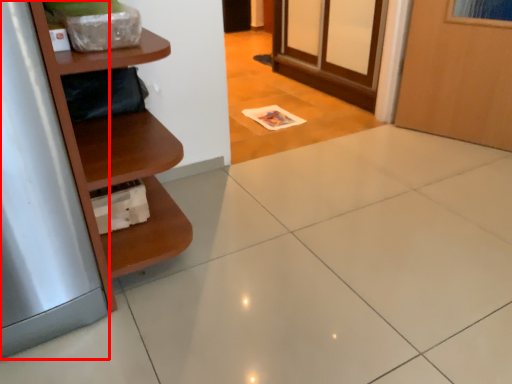
Question: From the image, what is the correct spatial relationship of silver (annotated by the red box) in relation to shelf?

Choices:
 (A) right
 (B) left

Answer: (B)